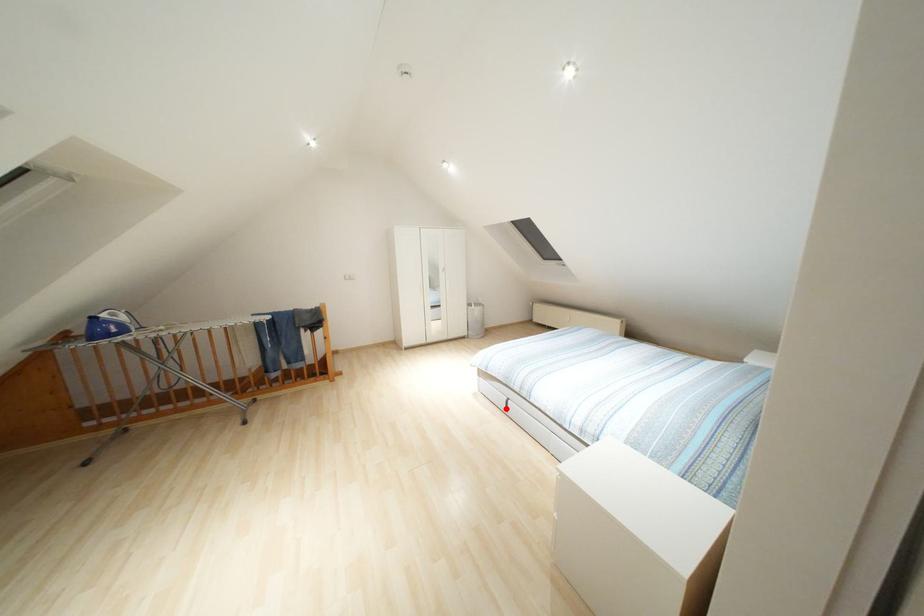
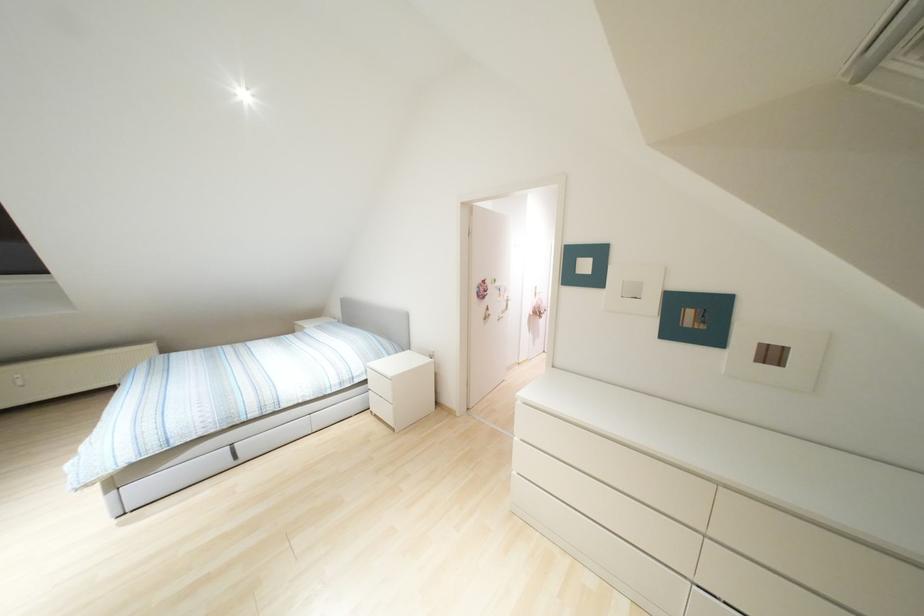
Question: I am providing you with two images of the same scene from different viewpoints. A red point is shown in image1. For the corresponding object point in image2, is it positioned nearer or farther from the camera?

Choices:
 (A) Nearer
 (B) Farther

Answer: (A)